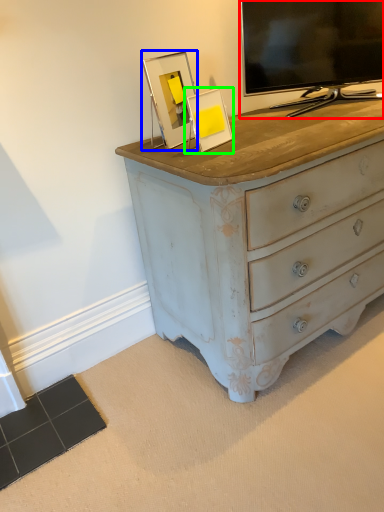
Question: Which object is positioned farthest from television (highlighted by a red box)? Select from picture frame (highlighted by a blue box) and picture frame (highlighted by a green box).

Choices:
 (A) picture frame
 (B) picture frame

Answer: (A)